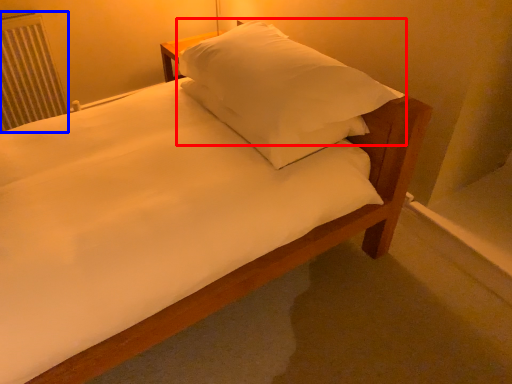
Question: Which object appears closest to the camera in this image, pillow (highlighted by a red box) or radiator (highlighted by a blue box)?

Choices:
 (A) pillow
 (B) radiator

Answer: (A)